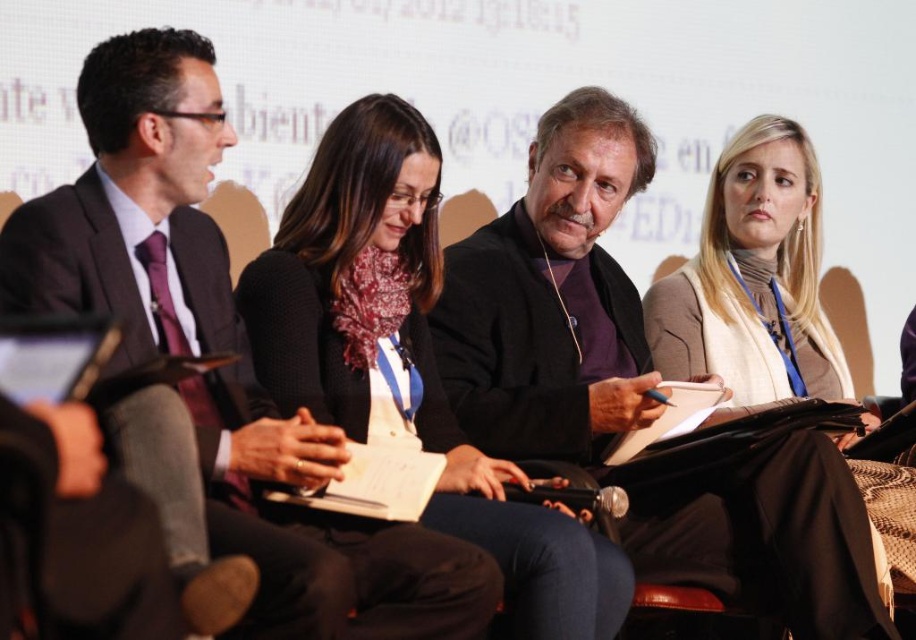
You are sitting in the audience and want to know which of the two points, point (402,236) or point (685,362), is closer to you. Which one should you look at?

Point (402,236) is closer to the viewer than point (685,362), so you should look at point (402,236).

You are attending a conference and need to decide which presenter to approach based on their attire. The matte black suit at left and the dark brown leather jacket at center are both presenters. Which presenter is wearing taller clothing?

The matte black suit at left has a greater height compared to the dark brown leather jacket at center, so the presenter wearing the matte black suit at left is taller in clothing.

You are a photographer standing at the camera position. You want to take a closeup of the matte black suit at left without zooming. How should you move?

The matte black suit at left is 9.20 meters from the camera. To take a closeup without zooming, you should move closer to the matte black suit at left until it fills the frame.